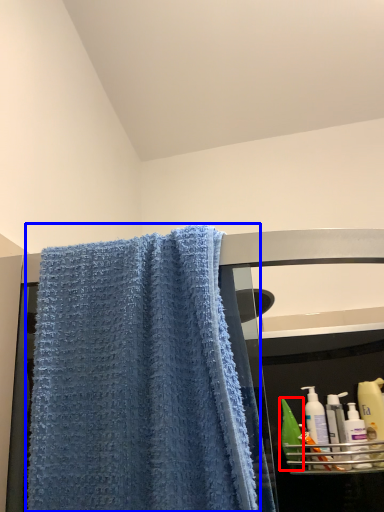
Question: Which object appears closest to the camera in this image, mouthwash (highlighted by a red box) or towel (highlighted by a blue box)?

Choices:
 (A) mouthwash
 (B) towel

Answer: (B)